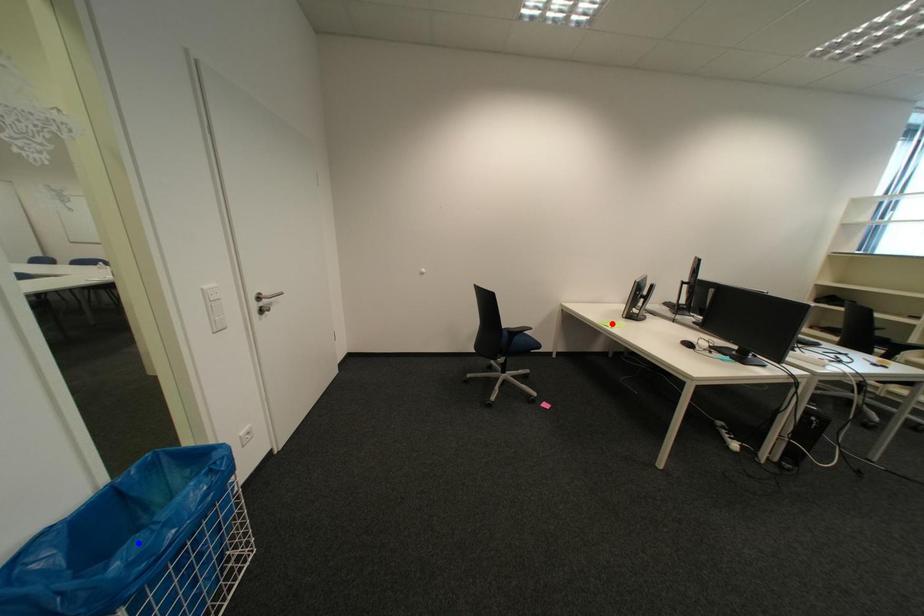
Question: Which of the two points in the image is closer to the camera?

Choices:
 (A) Blue point is closer.
 (B) Red point is closer.

Answer: (A)